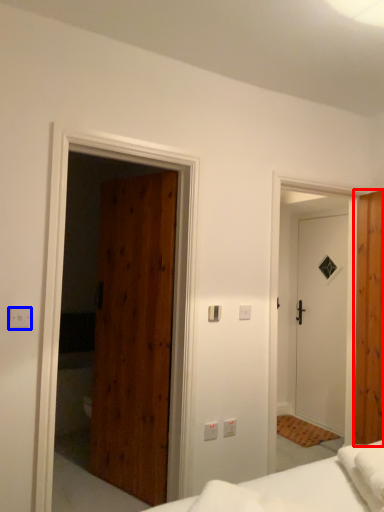
Question: Which of the following is the closest to the observer, door (highlighted by a red box) or electric outlet (highlighted by a blue box)?

Choices:
 (A) door
 (B) electric outlet

Answer: (B)